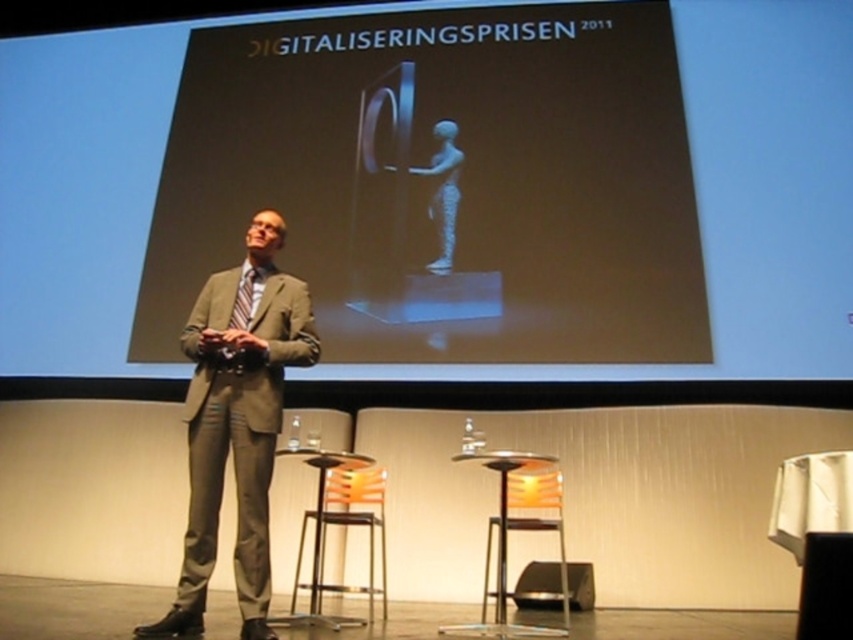
Between matte black screen at upper center and matte black suit at center, which one appears on the right side from the viewer's perspective?

Positioned to the right is matte black suit at center.

Is matte black screen at upper center wider than matte black suit at center?

Indeed, matte black screen at upper center has a greater width compared to matte black suit at center.

Is point (825, 77) more distant than point (541, 604)?

Yes, it is.

This screenshot has width=853, height=640. Find the location of `matte black screen at upper center`. matte black screen at upper center is located at coordinates (747, 196).

Which is below, matte gray suit at center or orange plastic chair at center?

Positioned lower is orange plastic chair at center.

Is point (254, 344) closer to camera compared to point (318, 552)?

Yes, point (254, 344) is in front of point (318, 552).

Image resolution: width=853 pixels, height=640 pixels. What are the coordinates of `matte gray suit at center` in the screenshot? It's located at (236, 424).

Does matte gray suit at center have a smaller size compared to striped fabric tie at center?

No.

Between point (225, 332) and point (252, 269), which one is positioned behind?

Positioned behind is point (252, 269).

The height and width of the screenshot is (640, 853). Identify the location of matte gray suit at center. (236, 424).

Image resolution: width=853 pixels, height=640 pixels. In order to click on matte gray suit at center in this screenshot , I will do `click(236, 424)`.